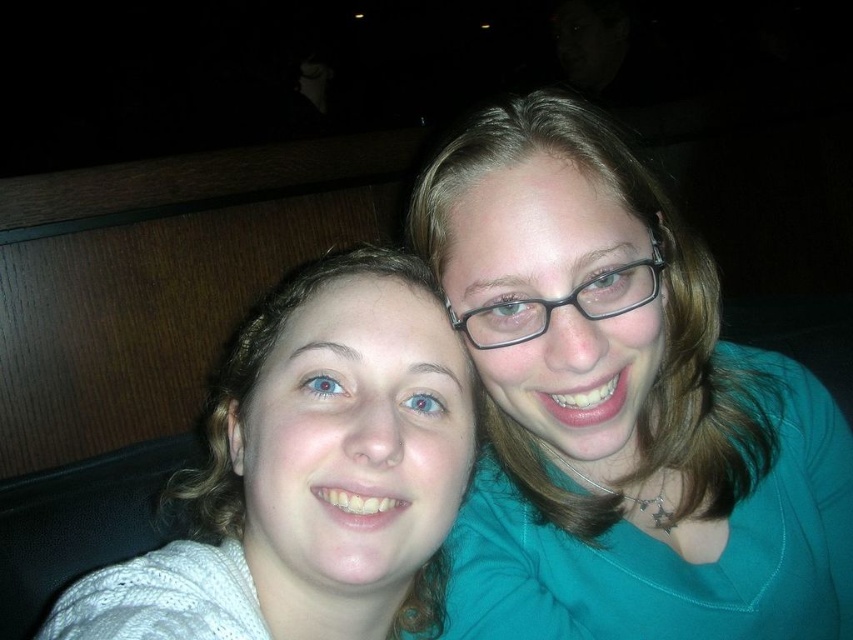
You are a photographer setting up for a group photo. You need to ensure that all clothing items are visible in the frame. Given the scene, can you confirm if the teal fabric shirt at upper right will fit within the frame if the white knit sweater at left is already centered?

The teal fabric shirt at upper right might be wider than the white knit sweater at left, so it may not fit within the frame if the white knit sweater at left is already centered. Adjust the camera angle or position to accommodate both items properly.

Consider the image. You are standing in front of the image and want to locate the teal fabric shirt at upper right. According to the coordinates provided, where exactly is it positioned?

The teal fabric shirt at upper right is positioned at coordinates point (621, 406).

You are a photographer trying to capture a clear shot of both the teal fabric shirt at upper right and the white knit sweater at left. Which one will appear closer to the camera in the photo?

The teal fabric shirt at upper right will appear closer to the camera because it is positioned further to the viewer than the white knit sweater at left.